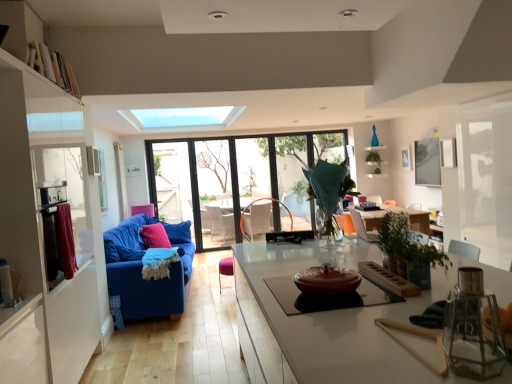
Question: Could blue fabric couch at left be considered to be inside blue fabric couch at left?

Choices:
 (A) no
 (B) yes

Answer: (A)

Question: Can you confirm if blue fabric couch at left is wider than blue fabric couch at left?

Choices:
 (A) no
 (B) yes

Answer: (A)

Question: Is there a large distance between blue fabric couch at left and blue fabric couch at left?

Choices:
 (A) yes
 (B) no

Answer: (A)

Question: Considering the relative sizes of blue fabric couch at left and blue fabric couch at left in the image provided, is blue fabric couch at left shorter than blue fabric couch at left?

Choices:
 (A) no
 (B) yes

Answer: (A)

Question: Is blue fabric couch at left in front of blue fabric couch at left?

Choices:
 (A) no
 (B) yes

Answer: (A)

Question: From a real-world perspective, is translucent glass vase at center, which appears as the 3th plant when viewed from the right, physically located above or below pink fabric pillow at center?

Choices:
 (A) above
 (B) below

Answer: (A)

Question: Looking at the image, does translucent glass vase at center, which appears as the first plant when viewed from the left, seem bigger or smaller compared to pink fabric pillow at center?

Choices:
 (A) big
 (B) small

Answer: (A)

Question: Would you say translucent glass vase at center, the 3th plant from the back, is to the left or to the right of pink fabric pillow at center in the picture?

Choices:
 (A) left
 (B) right

Answer: (B)

Question: Is translucent glass vase at center, which appears as the first plant when viewed from the left, taller or shorter than pink fabric pillow at center?

Choices:
 (A) short
 (B) tall

Answer: (B)

Question: From the image's perspective, relative to maroon fabric curtain at left, is white fabric swivel chair at center above or below?

Choices:
 (A) above
 (B) below

Answer: (B)

Question: Relative to maroon fabric curtain at left, is white fabric swivel chair at center in front or behind?

Choices:
 (A) behind
 (B) front

Answer: (A)

Question: From a real-world perspective, is white fabric swivel chair at center above or below maroon fabric curtain at left?

Choices:
 (A) above
 (B) below

Answer: (B)

Question: Does point (241, 221) appear closer or farther from the camera than point (72, 231)?

Choices:
 (A) farther
 (B) closer

Answer: (A)

Question: Looking at the image, does white fabric swivel chair at center seem bigger or smaller compared to blue fabric couch at left?

Choices:
 (A) big
 (B) small

Answer: (B)

Question: Considering their positions, is white fabric swivel chair at center located in front of or behind blue fabric couch at left?

Choices:
 (A) front
 (B) behind

Answer: (B)